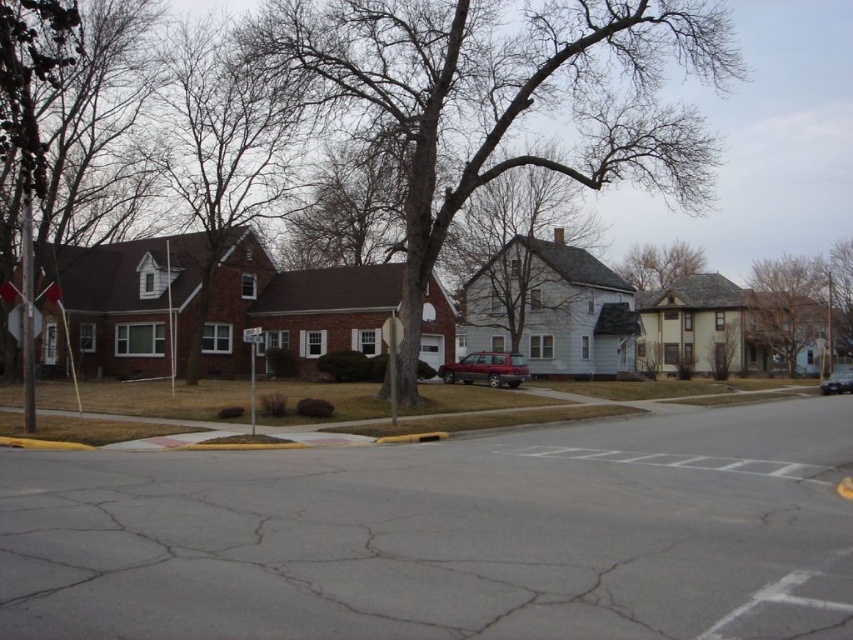
Question: Based on their relative distances, which object is nearer to the brown textured tree at upper center?

Choices:
 (A) smooth bark tree at center
 (B) metallic silver stop sign at center
 (C) metallic maroon suv at center

Answer: (A)

Question: Which point is farther to the camera?

Choices:
 (A) (807, 273)
 (B) (9, 332)
 (C) (465, 220)
 (D) (364, 58)

Answer: (A)

Question: Does brown textured tree at upper center have a greater width compared to shiny black car at lower right?

Choices:
 (A) no
 (B) yes

Answer: (B)

Question: Which of the following is the closest to the observer?

Choices:
 (A) metallic silver stop sign at left
 (B) smooth bark tree at center
 (C) bare wood tree at center

Answer: (A)

Question: Is brown textured tree at upper center thinner than metallic maroon suv at center?

Choices:
 (A) no
 (B) yes

Answer: (A)

Question: Is smooth bark tree at center smaller than metallic maroon suv at center?

Choices:
 (A) no
 (B) yes

Answer: (A)